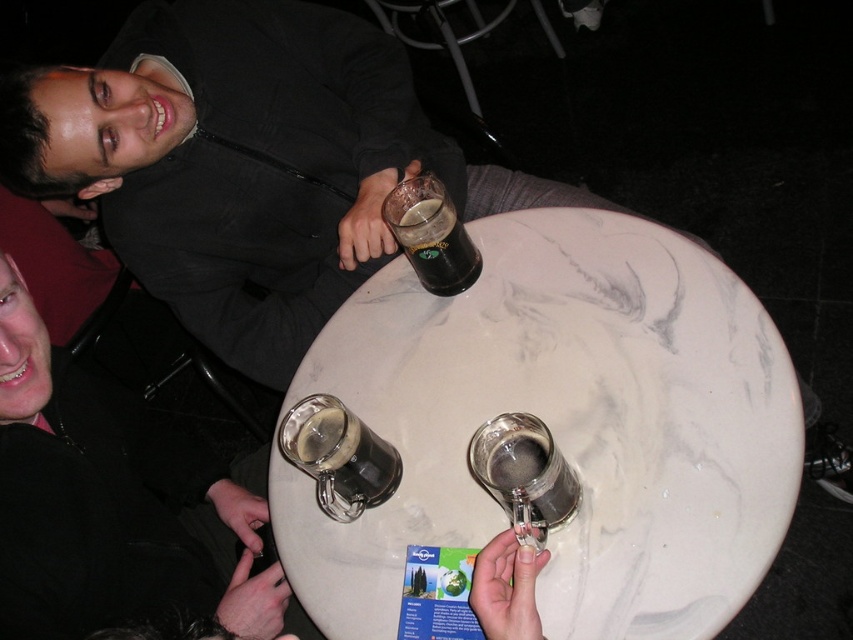
You are a bartender trying to place a new drink order on the table. The drink is in a container that is as wide as the dark glass mug at center. Will the white marble table at center have enough space to accommodate this new container?

The white marble table at center has a greater width than the dark glass mug at center, so yes, the white marble table at center can accommodate the new container since its width is sufficient to hold an item of that size.

You are standing in front of the round marble table and want to place a small decoration between the two points labeled point (795, 468) and point (444, 275). Which point should you move toward to place the decoration closer to the camera?

You should move toward point (795, 468) because it is closer to the camera than point (444, 275).